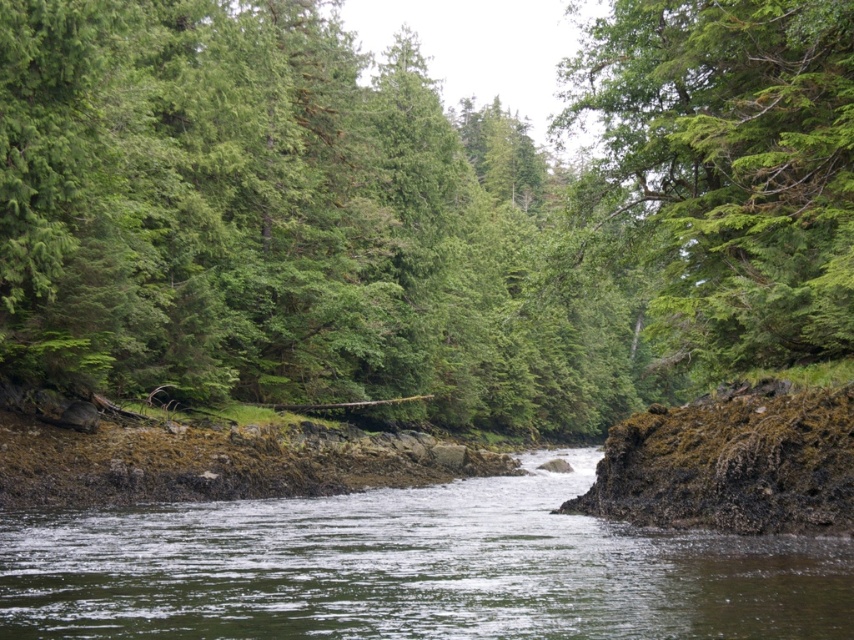
Who is shorter, green leafy tree at center or green mossy rock at center?

green mossy rock at center is shorter.

Is green leafy tree at center below green mossy rock at center?

Incorrect, green leafy tree at center is not positioned below green mossy rock at center.

Where is `green leafy tree at center`? This screenshot has height=640, width=854. green leafy tree at center is located at coordinates (419, 211).

Can you confirm if green mossy rock at center is positioned to the left of green leafy tree at upper center?

Correct, you'll find green mossy rock at center to the left of green leafy tree at upper center.

Is green mossy rock at center wider than green leafy tree at upper center?

Yes.

Who is more forward, (x=378, y=602) or (x=730, y=250)?

Point (x=378, y=602)

Identify the location of green mossy rock at center. The width and height of the screenshot is (854, 640). (411, 568).

Does green leafy tree at center have a lesser height compared to green leafy tree at upper center?

No.

Is point (618, 234) farther from viewer compared to point (804, 310)?

Yes, point (618, 234) is behind point (804, 310).

I want to click on green leafy tree at center, so click(x=419, y=211).